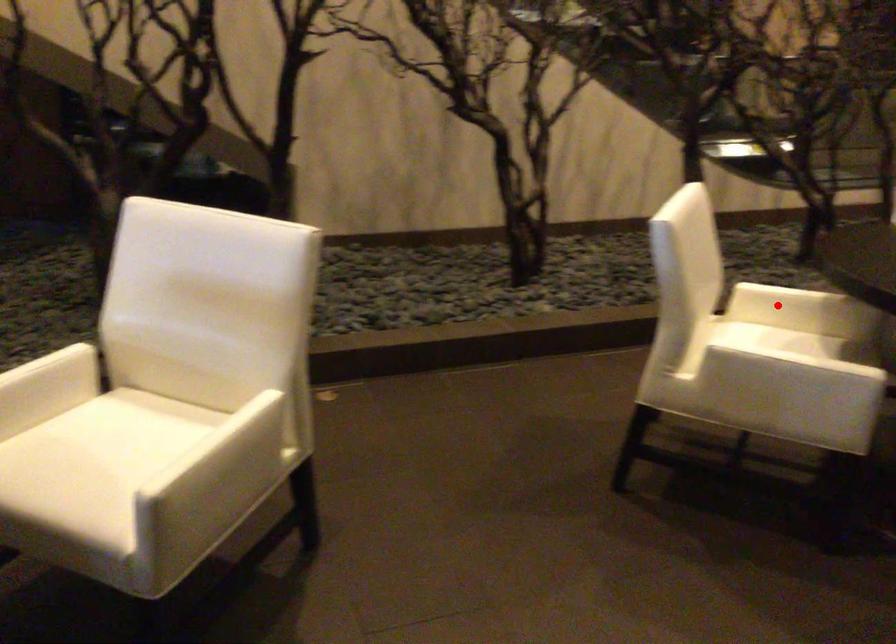
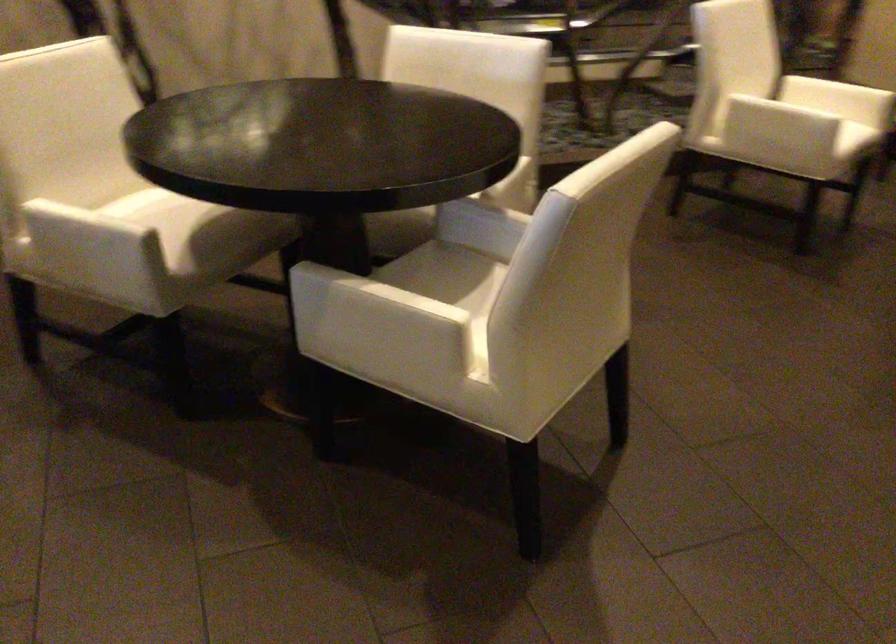
Question: I am providing you with two images of the same scene from different viewpoints. A red point is marked on the first image. At the location where the point appears in image 1, is it still visible in image 2?

Choices:
 (A) Yes
 (B) No

Answer: (B)